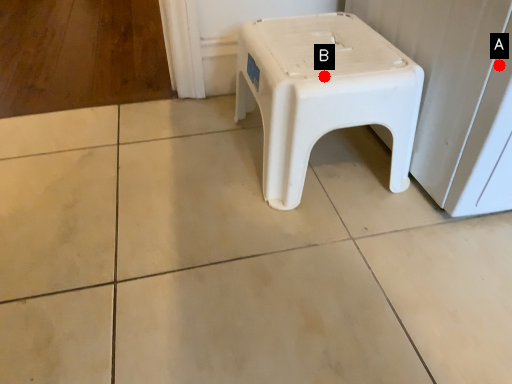
Question: Two points are circled on the image, labeled by A and B beside each circle. Which point is farther from the camera taking this photo?

Choices:
 (A) A is further
 (B) B is further

Answer: (B)